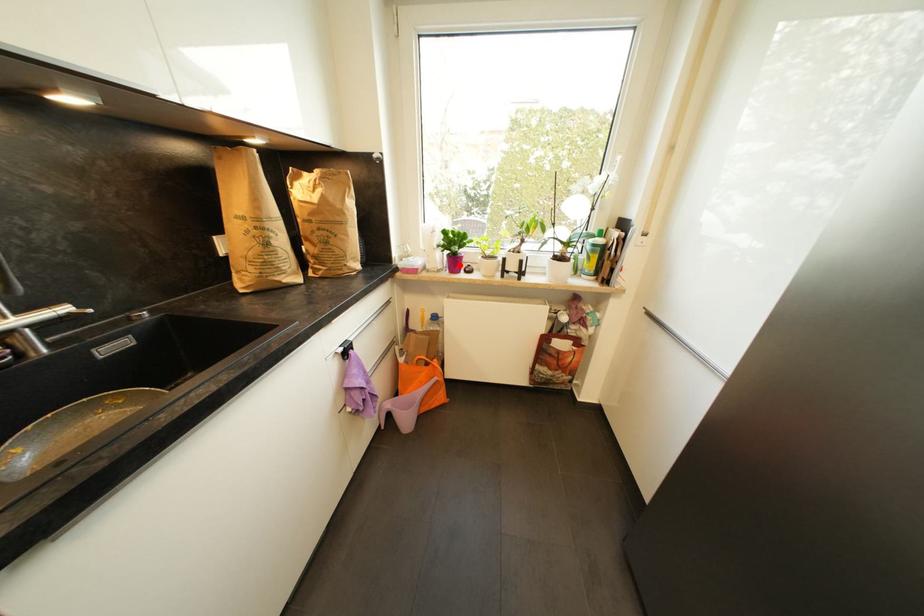
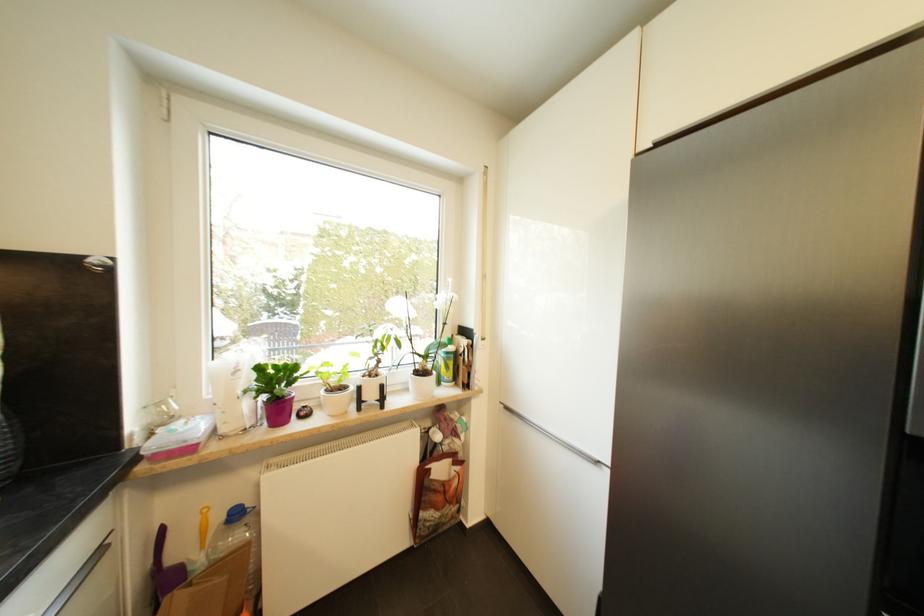
In the second image, find the point that corresponds to the highlighted location in the first image.

(285, 411)